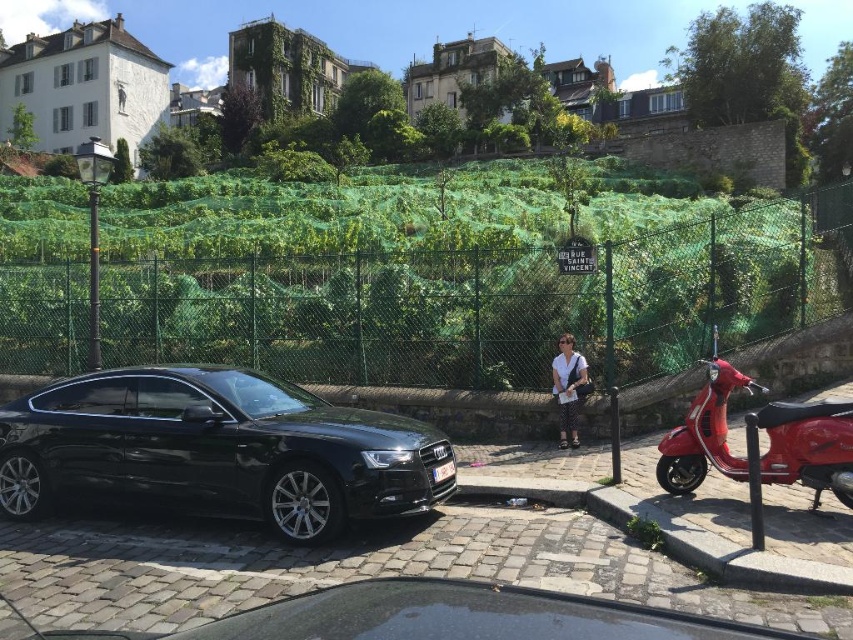
You are a delivery driver who needs to park your vehicle between the shiny black sedan at lower left and the shiny red scooter at right. Given that your vehicle is 4 meters wide, can you fit it there?

The shiny black sedan at lower left is wider than the shiny red scooter at right. However, without knowing the exact distance between them, it is impossible to determine if there is enough space for a 4 meter wide vehicle.

From the picture: You are a delivery person trying to find a parking spot near the shiny black sedan at lower left and the white cotton shirt at center. Which vehicle should you park closer to if you want to be closer to the person?

You should park closer to the white cotton shirt at center since the shiny black sedan at lower left is on the left side of the white cotton shirt at center, meaning the person is near the center and the sedan is to the left of them.